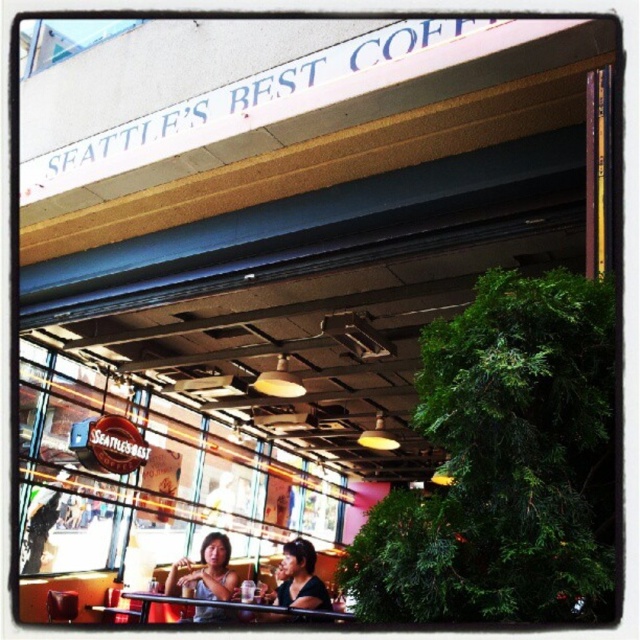
Which is below, matte white tank top at center or matte black shirt at lower center?

Positioned lower is matte white tank top at center.

Is matte white tank top at center below matte black shirt at lower center?

Yes, matte white tank top at center is below matte black shirt at lower center.

Which is in front, point (189, 588) or point (308, 588)?

Point (308, 588) is in front.

Locate an element on the screen. The width and height of the screenshot is (640, 640). matte white tank top at center is located at coordinates (204, 572).